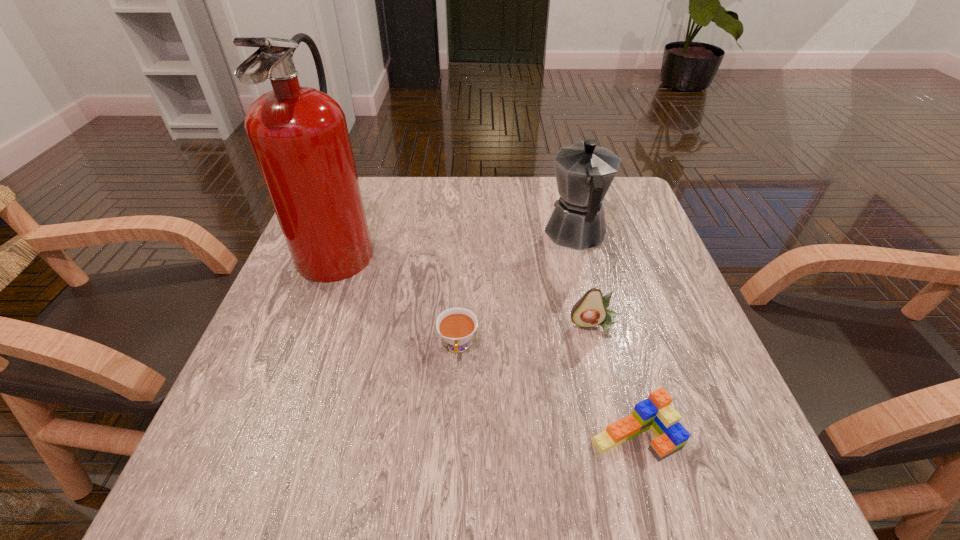
Identify the location of the leftmost object. (299, 136).

The image size is (960, 540). What are the coordinates of `the tallest object` in the screenshot? It's located at (299, 136).

Find the location of `coffeepot`. coffeepot is located at coordinates (584, 172).

The height and width of the screenshot is (540, 960). I want to click on avocado, so click(x=590, y=310).

Image resolution: width=960 pixels, height=540 pixels. Identify the location of Lego. (655, 413).

Image resolution: width=960 pixels, height=540 pixels. Identify the location of teacup. (457, 325).

Locate an element on the screen. This screenshot has width=960, height=540. the second object from left to right is located at coordinates (457, 325).

Find the location of a particular element. The height and width of the screenshot is (540, 960). vacant position located with the handle and nozzle on the tallest object is located at coordinates (453, 246).

Locate an element on the screen. This screenshot has height=540, width=960. free space located 0.150m at the spout of the second tallest object is located at coordinates (562, 179).

Find the location of a particular element. This screenshot has height=540, width=960. free space located on the seed side of the third shortest object is located at coordinates (631, 471).